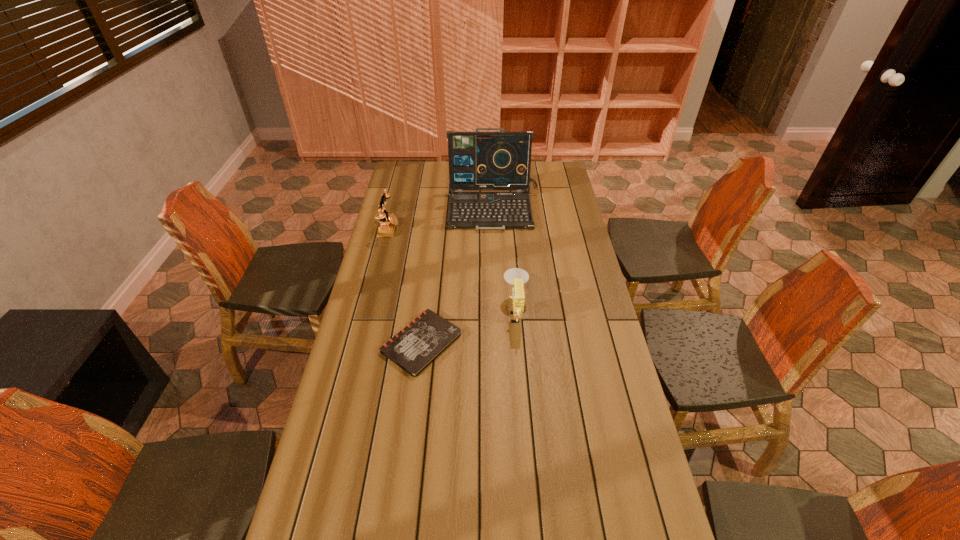
Locate an element on the screen. The width and height of the screenshot is (960, 540). vacant point located between the telephone and the shortest object is located at coordinates (405, 286).

This screenshot has height=540, width=960. In order to click on vacant region between the sponge and the notebook in this screenshot , I will do `click(468, 327)`.

The image size is (960, 540). Identify the location of free space between the notebook and the telephone. (405, 286).

Where is `vacant space in between the notebook and the laptop computer`? This screenshot has height=540, width=960. vacant space in between the notebook and the laptop computer is located at coordinates (458, 275).

Locate an element on the screen. This screenshot has width=960, height=540. free space that is in between the notebook and the leftmost object is located at coordinates (405, 286).

Find the location of a particular element. the third closest object to the leftmost object is located at coordinates (517, 277).

This screenshot has height=540, width=960. Identify the location of object that stands as the closest to the sponge. (426, 337).

This screenshot has height=540, width=960. Find the location of `vacant space that satisfies the following two spatial constraints: 1. on the front-facing side of the laptop computer; 2. on the dial of the telephone`. vacant space that satisfies the following two spatial constraints: 1. on the front-facing side of the laptop computer; 2. on the dial of the telephone is located at coordinates (494, 228).

Locate an element on the screen. The height and width of the screenshot is (540, 960). free space that satisfies the following two spatial constraints: 1. on the front-facing side of the tallest object; 2. on the dial of the leftmost object is located at coordinates (494, 228).

I want to click on free space that satisfies the following two spatial constraints: 1. on the dial of the notebook; 2. on the left side of the leftmost object, so click(x=360, y=342).